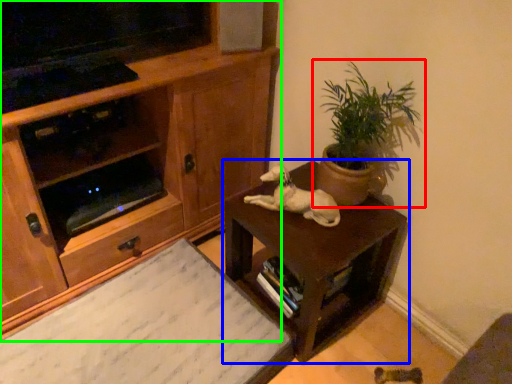
Question: Based on their relative distances, which object is nearer to houseplant (highlighted by a red box)? Choose from table (highlighted by a blue box) and cabinetry (highlighted by a green box).

Choices:
 (A) table
 (B) cabinetry

Answer: (A)